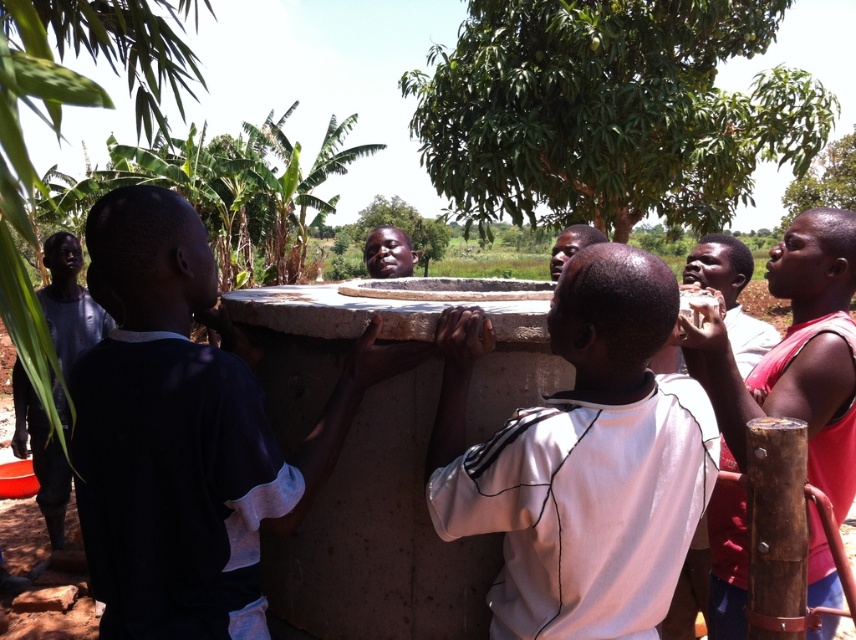
The height and width of the screenshot is (640, 856). Identify the location of white matte shirt at center. (580, 460).

Can you confirm if white matte shirt at center is wider than matte black head at center?

Yes, white matte shirt at center is wider than matte black head at center.

Between point (660, 262) and point (399, 250), which one is positioned behind?

The point (399, 250) is more distant.

Where is `white matte shirt at center`? The image size is (856, 640). white matte shirt at center is located at coordinates (580, 460).

This screenshot has height=640, width=856. Describe the element at coordinates (186, 435) in the screenshot. I see `dark blue shirt at left` at that location.

Can you confirm if dark blue shirt at left is wider than white matte shirt at center?

Correct, the width of dark blue shirt at left exceeds that of white matte shirt at center.

Image resolution: width=856 pixels, height=640 pixels. Find the location of `dark blue shirt at left`. dark blue shirt at left is located at coordinates (186, 435).

Is dark blue shirt at left thinner than matte black head at center?

In fact, dark blue shirt at left might be wider than matte black head at center.

Is dark blue shirt at left to the right of matte black head at center from the viewer's perspective?

No, dark blue shirt at left is not to the right of matte black head at center.

At what (x,y) coordinates should I click in order to perform the action: click on dark blue shirt at left. Please return your answer as a coordinate pair (x, y). The height and width of the screenshot is (640, 856). Looking at the image, I should click on (186, 435).